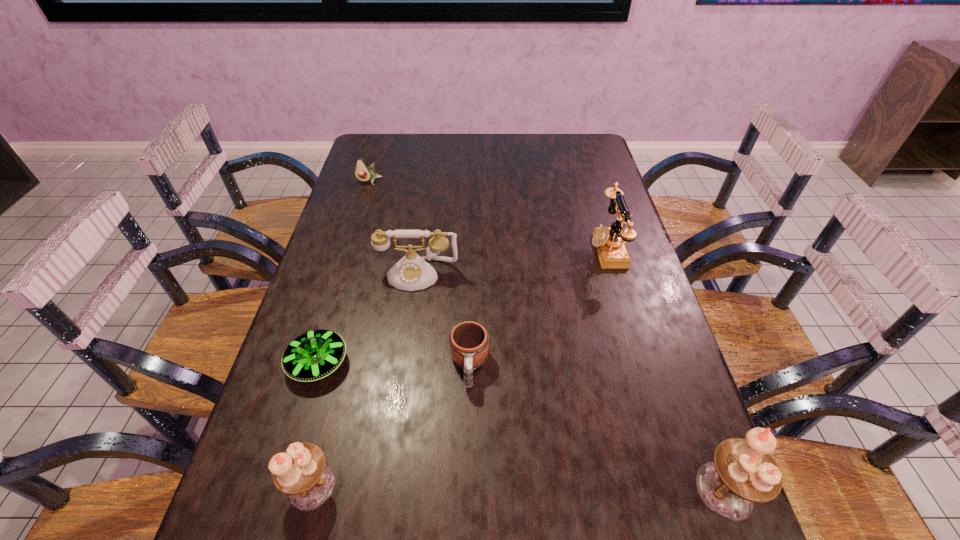
Image resolution: width=960 pixels, height=540 pixels. What are the coordinates of `vacant position located on the back of the right candle holder` in the screenshot? It's located at (679, 364).

Identify the location of vacant space located 0.360m on the seed side of the avocado. (346, 258).

This screenshot has width=960, height=540. I want to click on free location located on the dial of the fourth tallest object, so click(399, 406).

Find the location of a particular element. free region located 0.140m on the side of the mug with the handle is located at coordinates (468, 458).

This screenshot has width=960, height=540. I want to click on vacant space situated on the dial of the right telephone, so click(484, 249).

Locate an element on the screen. free region located on the dial of the right telephone is located at coordinates (563, 249).

Where is `vacant space located 0.100m on the dial of the right telephone`? Image resolution: width=960 pixels, height=540 pixels. vacant space located 0.100m on the dial of the right telephone is located at coordinates (556, 249).

You are a GUI agent. You are given a task and a screenshot of the screen. Output one action in this format:
    pyautogui.click(x=<x>, y=<y>)
    Task: Click on the free point located 0.200m on the front of the shortest object
    The height and width of the screenshot is (540, 960).
    Given the screenshot: What is the action you would take?
    pyautogui.click(x=281, y=486)

At what (x,y) coordinates should I click in order to perform the action: click on candle holder that is at the left edge. Please return your answer as a coordinate pair (x, y). The image size is (960, 540). Looking at the image, I should click on (301, 472).

Locate an element on the screen. The width and height of the screenshot is (960, 540). avocado at the left edge is located at coordinates (363, 173).